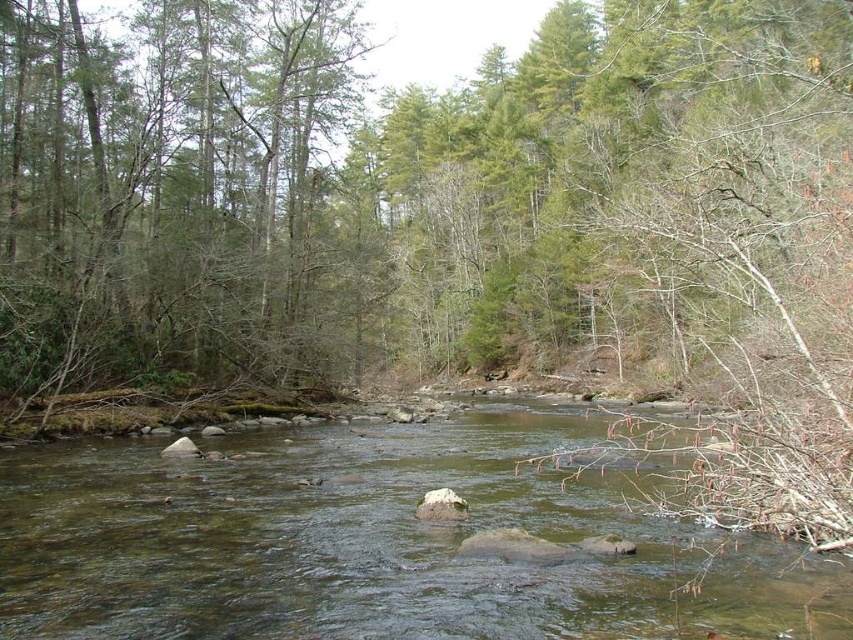
You are a hiker who wants to cross the river at the location shown in the image. The green mossy rocks at center are positioned at coordinates 0.850, 0.434. Are these rocks located closer to the left or right bank of the river?

The green mossy rocks at center are positioned at coordinates (369, 544), which places them closer to the right bank of the river.

From the picture: You are a hiker trying to cross the river using the green mossy rocks at center and the bare branches at right as landmarks. Which object is taller from your viewpoint?

The bare branches at right are taller than the green mossy rocks at center.

You are a hiker who wants to cross the river using the green mossy rocks at center. There is a tree with bare branches at right that you need to avoid. Can you safely cross the river without getting too close to the tree? Explain your reasoning based on the distance between the rocks and the tree.

The green mossy rocks at center and the bare branches at right are 15.83 meters apart. Since the rocks are positioned centrally and the tree is at the right, the distance allows you to cross the river safely while maintaining enough space to avoid the tree.